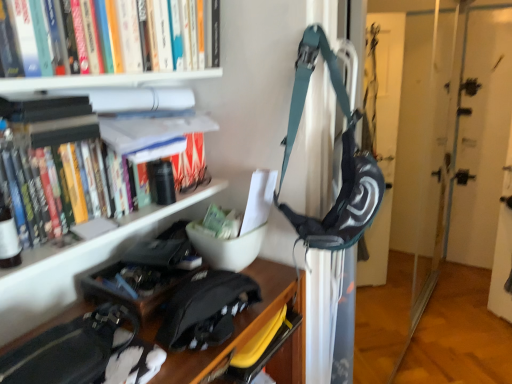
Question: From a real-world perspective, relative to white matte bookshelf at upper left, is hardcover books at upper left vertically above or below?

Choices:
 (A) below
 (B) above

Answer: (B)

Question: Considering the positions of hardcover books at upper left and white matte bookshelf at upper left in the image, is hardcover books at upper left wider or thinner than white matte bookshelf at upper left?

Choices:
 (A) wide
 (B) thin

Answer: (A)

Question: Estimate the real-world distances between objects in this image. Which object is closer to the white matte bookshelf at upper left?

Choices:
 (A) black matte messenger bag at lower center
 (B) hardcover books at upper left
 (C) teal fabric backpack at center

Answer: (B)

Question: Which object is positioned farthest from the hardcover books at upper left?

Choices:
 (A) black matte messenger bag at lower center
 (B) white matte bookshelf at upper left
 (C) teal fabric backpack at center

Answer: (C)